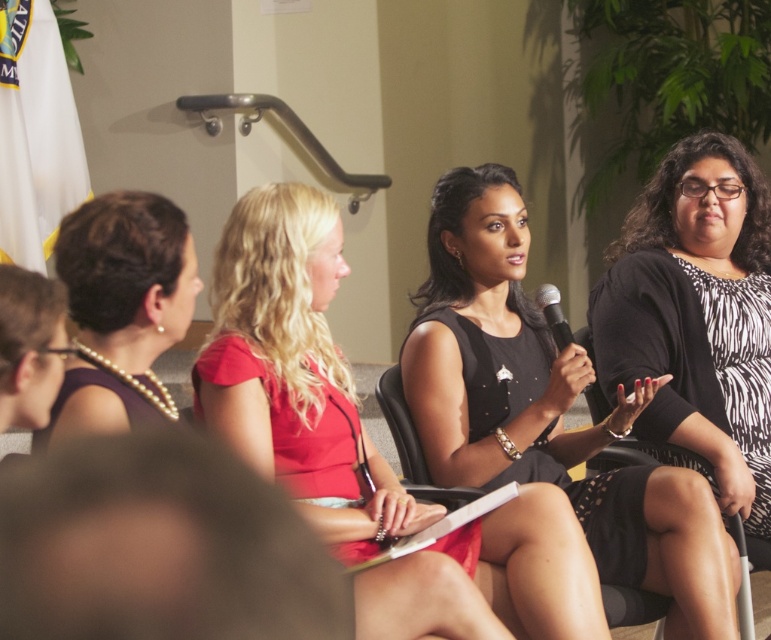
You are sitting in the audience of the panel discussion and want to know which of the two points, point [406,612] or point [162,289], is closer to you. Can you determine this based on the scene?

Point [406,612] is closer to the viewer than point [162,289].